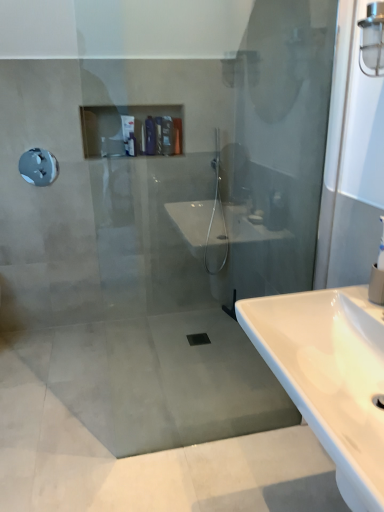
Question: Is matte plastic toiletries at upper center, the 1th toiletry when ordered from right to left, behind white glossy bottle at upper left, which is the 3th toiletry from right to left?

Choices:
 (A) yes
 (B) no

Answer: (A)

Question: Can you confirm if matte plastic toiletries at upper center, the third toiletry when ordered from left to right, is thinner than white glossy bottle at upper left, which is the 3th toiletry from right to left?

Choices:
 (A) no
 (B) yes

Answer: (A)

Question: From the image's perspective, is matte plastic toiletries at upper center, the 1th toiletry when ordered from right to left, on top of white glossy bottle at upper left, positioned as the 1th toiletry in left-to-right order?

Choices:
 (A) no
 (B) yes

Answer: (B)

Question: Can you confirm if matte plastic toiletries at upper center, the 1th toiletry when ordered from right to left, is shorter than white glossy bottle at upper left, positioned as the 1th toiletry in left-to-right order?

Choices:
 (A) no
 (B) yes

Answer: (B)

Question: From a real-world perspective, is matte plastic toiletries at upper center, the third toiletry when ordered from left to right, on top of white glossy bottle at upper left, which is the 3th toiletry from right to left?

Choices:
 (A) no
 (B) yes

Answer: (A)

Question: From the image's perspective, is matte plastic toiletries at upper center, the third toiletry when ordered from left to right, located beneath white glossy bottle at upper left, which is the 3th toiletry from right to left?

Choices:
 (A) no
 (B) yes

Answer: (A)

Question: Does matte plastic toiletries at upper center, the third toiletry when ordered from left to right, have a lesser width compared to metallic gray showerhead at upper left?

Choices:
 (A) no
 (B) yes

Answer: (A)

Question: Considering the relative sizes of matte plastic toiletries at upper center, the 1th toiletry when ordered from right to left, and metallic gray showerhead at upper left in the image provided, is matte plastic toiletries at upper center, the 1th toiletry when ordered from right to left, bigger than metallic gray showerhead at upper left?

Choices:
 (A) no
 (B) yes

Answer: (B)

Question: From a real-world perspective, is matte plastic toiletries at upper center, the third toiletry when ordered from left to right, positioned over metallic gray showerhead at upper left based on gravity?

Choices:
 (A) yes
 (B) no

Answer: (A)

Question: Can metallic gray showerhead at upper left be found inside matte plastic toiletries at upper center, the 1th toiletry when ordered from right to left?

Choices:
 (A) no
 (B) yes

Answer: (A)

Question: Does matte plastic toiletries at upper center, the 1th toiletry when ordered from right to left, have a smaller size compared to metallic gray showerhead at upper left?

Choices:
 (A) no
 (B) yes

Answer: (A)

Question: From the image's perspective, is matte plastic toiletries at upper center, the third toiletry when ordered from left to right, over metallic gray showerhead at upper left?

Choices:
 (A) yes
 (B) no

Answer: (A)

Question: From a real-world perspective, is white glossy sink at lower right located beneath matte plastic toiletries at upper center, the third toiletry when ordered from left to right?

Choices:
 (A) yes
 (B) no

Answer: (A)